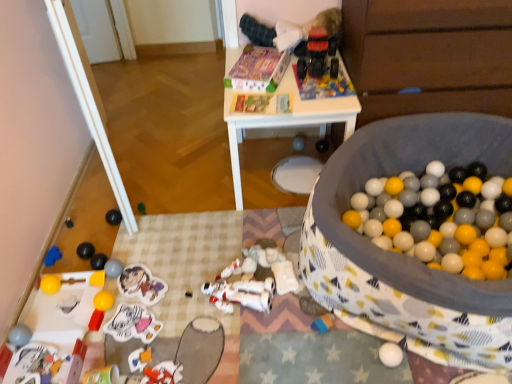
I want to click on free space in front of matte cardboard stickers at lower center, which appears as the ninth toy when viewed from the right, so click(133, 331).